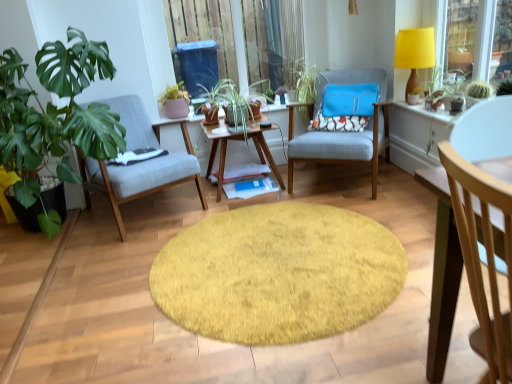
What do you see at coordinates (305, 81) in the screenshot?
I see `green leafy plant at center` at bounding box center [305, 81].

Find the location of a particular element. The image size is (512, 384). green leafy plant at center is located at coordinates (305, 81).

Image resolution: width=512 pixels, height=384 pixels. What do you see at coordinates (220, 150) in the screenshot?
I see `woodenwoodencoffee table at center` at bounding box center [220, 150].

What are the coordinates of `matte gray chair at left, the first chair in the left-to-right sequence` in the screenshot? It's located at (140, 177).

The height and width of the screenshot is (384, 512). What do you see at coordinates (278, 273) in the screenshot?
I see `yellow shaggy rug at center` at bounding box center [278, 273].

I want to click on yellow shaggy rug at center, so click(278, 273).

Measure the distance between transparent plastic window screen at upper center and camera.

transparent plastic window screen at upper center is 3.23 meters from camera.

What are the coordinates of `green leafy plant at center` in the screenshot? It's located at (305, 81).

Is floral fabric pillow at center far from matte gray chair at left, acting as the 2th chair starting from the back?

Yes, floral fabric pillow at center and matte gray chair at left, acting as the 2th chair starting from the back, are located far from each other.

From the picture: From a real-world perspective, is floral fabric pillow at center positioned above or below matte gray chair at left, acting as the 2th chair starting from the back?

floral fabric pillow at center is situated higher than matte gray chair at left, acting as the 2th chair starting from the back, in the real world.

Considering the positions of points (337, 124) and (120, 109), is point (337, 124) farther from camera compared to point (120, 109)?

Yes.

Considering the relative positions of floral fabric pillow at center and matte gray chair at left, the second chair viewed from the front, in the image provided, is floral fabric pillow at center to the left of matte gray chair at left, the second chair viewed from the front, from the viewer's perspective?

Incorrect, floral fabric pillow at center is not on the left side of matte gray chair at left, the second chair viewed from the front.

Which object is further away from the camera taking this photo, yellow shaggy rug at center or transparent plastic window screen at upper center?

transparent plastic window screen at upper center is further away from the camera.

At what (x,y) coordinates should I click in order to perform the action: click on window screen behind the yellow shaggy rug at center. Please return your answer as a coordinate pair (x, y). This screenshot has height=384, width=512. Looking at the image, I should click on (272, 39).

Based on the photo, is yellow shaggy rug at center directly adjacent to transparent plastic window screen at upper center?

They are not placed beside each other.

Based on their sizes in the image, would you say yellow shaggy rug at center is bigger or smaller than transparent plastic window screen at upper center?

Considering their sizes, yellow shaggy rug at center takes up less space than transparent plastic window screen at upper center.

Is yellow shaggy rug at center completely or partially outside of yellow fabric lampshade at upper right?

yellow shaggy rug at center lies outside yellow fabric lampshade at upper right's area.

How different are the orientations of yellow shaggy rug at center and yellow fabric lampshade at upper right in degrees?

The angle between the facing direction of yellow shaggy rug at center and the facing direction of yellow fabric lampshade at upper right is 0.66 degrees.

From the picture: Is yellow shaggy rug at center thinner than yellow fabric lampshade at upper right?

Incorrect, the width of yellow shaggy rug at center is not less than that of yellow fabric lampshade at upper right.

From a real-world perspective, is yellow shaggy rug at center on top of yellow fabric lampshade at upper right?

No, from a real-world perspective, yellow shaggy rug at center is not over yellow fabric lampshade at upper right

Is woodenwoodencoffee table at center directly adjacent to matte pink pot at center, which is counted as the first houseplant, starting from the back?

There is a gap between woodenwoodencoffee table at center and matte pink pot at center, which is counted as the first houseplant, starting from the back.

Does point (220, 136) lie behind point (178, 114)?

No, it is in front of (178, 114).

From the image's perspective, does woodenwoodencoffee table at center appear higher than matte pink pot at center, the 1th houseplant in the right-to-left sequence?

No, from the image's perspective, woodenwoodencoffee table at center is not on top of matte pink pot at center, the 1th houseplant in the right-to-left sequence.

Is the position of woodenwoodencoffee table at center more distant than that of matte pink pot at center, the 1th houseplant in the right-to-left sequence?

No, woodenwoodencoffee table at center is closer to the camera.

Is green leafy plant at left, the first houseplant positioned from the left, with light wood chair at right, arranged as the first chair when viewed from the front?

No, green leafy plant at left, the first houseplant positioned from the left, is not with light wood chair at right, arranged as the first chair when viewed from the front.

How many degrees apart are the facing directions of green leafy plant at left, which is the 1th houseplant in front-to-back order, and light wood chair at right, the third chair in the back-to-front sequence?

The facing directions of green leafy plant at left, which is the 1th houseplant in front-to-back order, and light wood chair at right, the third chair in the back-to-front sequence, are 1.57 degrees apart.

Consider the image. Is green leafy plant at left, marked as the second houseplant in a back-to-front arrangement, oriented away from light wood chair at right, arranged as the first chair when viewed from the front?

green leafy plant at left, marked as the second houseplant in a back-to-front arrangement, is not turned away from light wood chair at right, arranged as the first chair when viewed from the front.

From a real-world perspective, is green leafy plant at left, acting as the 2th houseplant starting from the right, positioned above or below light wood chair at right, the third chair in the back-to-front sequence?

green leafy plant at left, acting as the 2th houseplant starting from the right, is situated higher than light wood chair at right, the third chair in the back-to-front sequence, in the real world.

Is woodenobject at center taller or shorter than floral fabric pillow at center?

woodenobject at center is taller than floral fabric pillow at center.

Is woodenobject at center positioned far away from floral fabric pillow at center?

Yes, woodenobject at center is far from floral fabric pillow at center.

Based on their sizes in the image, would you say woodenobject at center is bigger or smaller than floral fabric pillow at center?

woodenobject at center is bigger than floral fabric pillow at center.

Looking at this image, considering the positions of objects woodenobject at center and floral fabric pillow at center in the image provided, who is more to the right, woodenobject at center or floral fabric pillow at center?

Positioned to the right is floral fabric pillow at center.

Between point (91, 175) and point (297, 79), which one is positioned in front?

The point (91, 175) is closer.

Are matte gray chair at left, acting as the 2th chair starting from the back, and green leafy plant at center making contact?

There is a gap between matte gray chair at left, acting as the 2th chair starting from the back, and green leafy plant at center.

How many degrees apart are the facing directions of matte gray chair at left, placed as the 3th chair when sorted from right to left, and green leafy plant at center?

The facing directions of matte gray chair at left, placed as the 3th chair when sorted from right to left, and green leafy plant at center are 26.2 degrees apart.

Does matte gray chair at left, the second chair viewed from the front, have a smaller size compared to green leafy plant at center?

No.

The width and height of the screenshot is (512, 384). Identify the location of pillow above the matte gray chair at left, the second chair viewed from the front (from the image's perspective). (337, 123).

Locate an element on the screen. Image resolution: width=512 pixels, height=384 pixels. mat directly beneath the transparent plastic window screen at upper center (from a real-world perspective) is located at coordinates (278, 273).

Based on their spatial positions, is yellow shaggy rug at center or green leafy plant at left, marked as the second houseplant in a back-to-front arrangement, further from yellow fabric lampshade at upper right?

green leafy plant at left, marked as the second houseplant in a back-to-front arrangement, is further to yellow fabric lampshade at upper right.

Estimate the real-world distances between objects in this image. Which object is further from textured fabric armchair at center, the 1th chair viewed from the back, matte gray chair at left, placed as the 3th chair when sorted from right to left, or matte pink pot at center, the 1th houseplant in the right-to-left sequence?

matte pink pot at center, the 1th houseplant in the right-to-left sequence, is further to textured fabric armchair at center, the 1th chair viewed from the back.

From the image, which object appears to be farther from yellow shaggy rug at center, floral fabric pillow at center or green leafy plant at left, acting as the 2th houseplant starting from the right?

The object further to yellow shaggy rug at center is floral fabric pillow at center.

Estimate the real-world distances between objects in this image. Which object is closer to yellow shaggy rug at center, transparent plastic window screen at upper center or green leafy plant at center?

green leafy plant at center is positioned closer to the anchor yellow shaggy rug at center.

From the image, which object appears to be nearer to light wood chair at right, marked as the 1th chair in a right-to-left arrangement, transparent plastic window screen at upper center or woodenwoodencoffee table at center?

woodenwoodencoffee table at center is positioned closer to the anchor light wood chair at right, marked as the 1th chair in a right-to-left arrangement.

From the image, which object appears to be nearer to matte pink pot at center, the 1th houseplant in the right-to-left sequence, green leafy plant at left, the first houseplant positioned from the left, or light wood chair at right, marked as the 1th chair in a right-to-left arrangement?

green leafy plant at left, the first houseplant positioned from the left.

Based on the photo, based on their spatial positions, is matte gray chair at left, placed as the 3th chair when sorted from right to left, or textured fabric armchair at center, marked as the 2th chair in a left-to-right arrangement, further from woodenobject at center?

textured fabric armchair at center, marked as the 2th chair in a left-to-right arrangement, is further to woodenobject at center.

Which object lies further to the anchor point yellow shaggy rug at center, floral fabric pillow at center or green leafy plant at center?

green leafy plant at center.

Find the location of a particular element. pillow between matte pink pot at center, the 1th houseplant in the right-to-left sequence, and textured fabric armchair at center, the 1th chair viewed from the back is located at coordinates (337, 123).

Identify the location of coffee table positioned between light wood chair at right, marked as the 1th chair in a right-to-left arrangement, and floral fabric pillow at center from near to far. (220, 150).

This screenshot has height=384, width=512. Identify the location of coffee table between woodenobject at center and textured fabric armchair at center, marked as the 2th chair in a left-to-right arrangement, in the horizontal direction. (220, 150).

Locate an element on the screen. Image resolution: width=512 pixels, height=384 pixels. pillow between green leafy plant at left, the first houseplant positioned from the left, and light wood chair at right, the third chair in the back-to-front sequence is located at coordinates (337, 123).